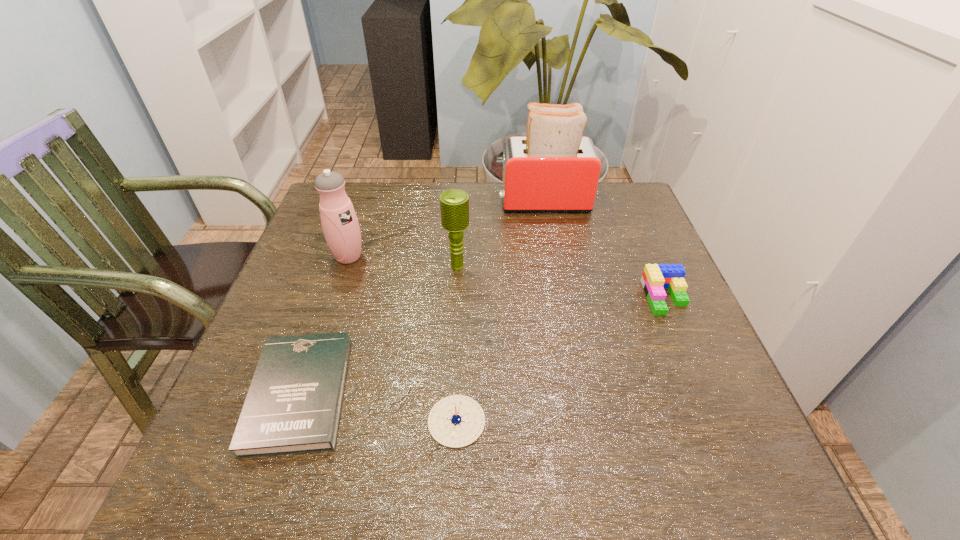
Locate an element on the screen. This screenshot has height=540, width=960. the farthest object is located at coordinates (554, 169).

Where is `toaster`? Image resolution: width=960 pixels, height=540 pixels. toaster is located at coordinates (554, 169).

Locate an element on the screen. This screenshot has width=960, height=540. thermos bottle is located at coordinates (341, 229).

Where is `microphone`? The width and height of the screenshot is (960, 540). microphone is located at coordinates (454, 204).

You are a GUI agent. You are given a task and a screenshot of the screen. Output one action in this format:
    pyautogui.click(x=<x>, y=<y>)
    Task: Click on the fourth farthest object
    Image resolution: width=960 pixels, height=540 pixels.
    Given the screenshot: What is the action you would take?
    pyautogui.click(x=655, y=277)

Image resolution: width=960 pixels, height=540 pixels. I want to click on Lego, so [655, 277].

You are a GUI agent. You are given a task and a screenshot of the screen. Output one action in this format:
    pyautogui.click(x=<x>, y=<y>)
    Task: Click on the compass
    
    Given the screenshot: What is the action you would take?
    pyautogui.click(x=456, y=421)

Find the location of a particular element. This screenshot has height=540, width=960. book is located at coordinates (293, 406).

The image size is (960, 540). Find the location of `vacant space located on the front-facing side of the farthest object`. vacant space located on the front-facing side of the farthest object is located at coordinates (461, 201).

Locate an element on the screen. The height and width of the screenshot is (540, 960). free space located 0.330m on the front-facing side of the farthest object is located at coordinates (381, 201).